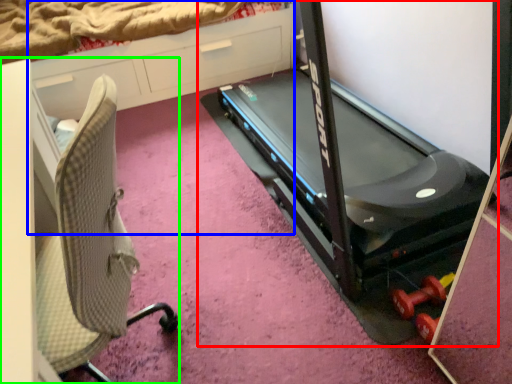
Question: Which object is the farthest from treadmill (highlighted by a red box)? Choose among these: dresser (highlighted by a blue box) or furniture (highlighted by a green box).

Choices:
 (A) dresser
 (B) furniture

Answer: (B)